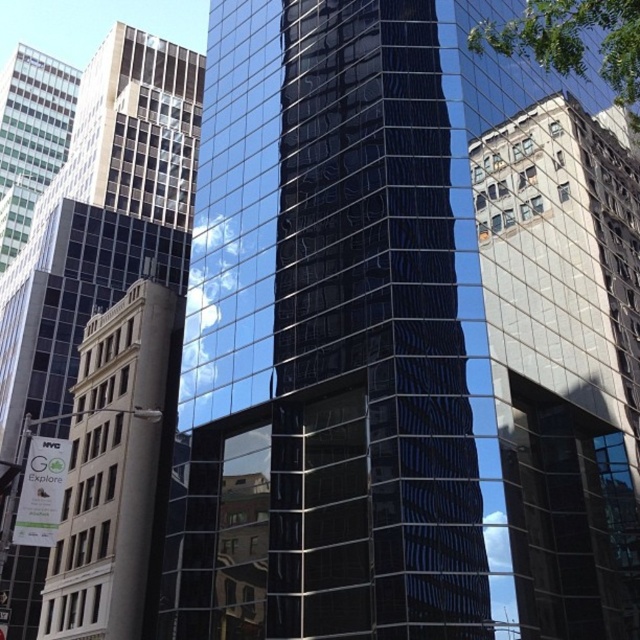
Who is positioned more to the right, reflective glass building at center or matte glass skyscraper at upper left?

Positioned to the right is reflective glass building at center.

Is point (518, 172) farther from camera compared to point (128, 244)?

No, it is in front of (128, 244).

Who is more forward, (509, 230) or (65, 285)?

Point (509, 230)

At what (x,y) coordinates should I click in order to perform the action: click on reflective glass building at center. Please return your answer as a coordinate pair (x, y). The width and height of the screenshot is (640, 640). Looking at the image, I should click on (564, 360).

Is point (60, 193) farther from camera compared to point (108, 452)?

Yes, it is.

Can you confirm if matte glass skyscraper at upper left is shorter than white stone tower at left?

Incorrect, matte glass skyscraper at upper left's height does not fall short of white stone tower at left's.

Locate an element on the screen. The width and height of the screenshot is (640, 640). matte glass skyscraper at upper left is located at coordinates [100, 216].

Locate an element on the screen. The image size is (640, 640). matte glass skyscraper at upper left is located at coordinates (100, 216).

Can you confirm if glossy glass tower at center is positioned below reflective glass building at center?

Incorrect, glossy glass tower at center is not positioned below reflective glass building at center.

In the scene shown: Is glossy glass tower at center positioned before reflective glass building at center?

Yes, glossy glass tower at center is closer to the viewer.

You are a GUI agent. You are given a task and a screenshot of the screen. Output one action in this format:
    pyautogui.click(x=<x>, y=<y>)
    Task: Click on the glossy glass tower at center
    This screenshot has width=640, height=640.
    Given the screenshot: What is the action you would take?
    [326, 337]

This screenshot has height=640, width=640. I want to click on glossy glass tower at center, so click(x=326, y=337).